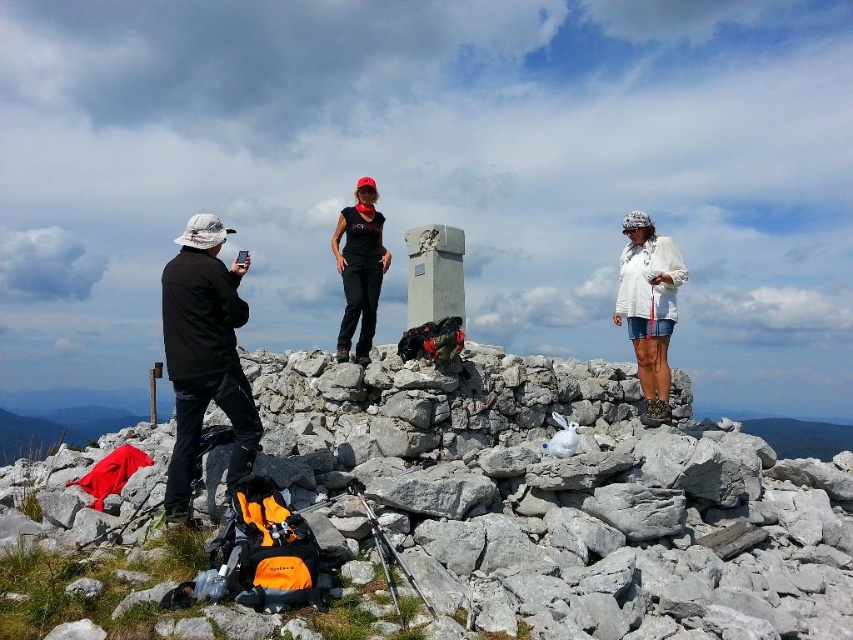
You are planning to take a photo of the black matte jacket at left from your current position. Based on the coordinates provided, is the jacket positioned to the left or right side of the image?

The black matte jacket at left is located at point 0.556 on the x and y axis, which places it on the left side of the image.

Based on the coordinates provided, which hiker is located at point (x=204, y=355)?

The black matte jacket at left is located at point (x=204, y=355).

You are a photographer trying to capture the scene. The white cotton shirt at upper right and the black matte shirt at center are both in your frame. Which shirt should you focus on if you want to highlight a smaller clothing item in your photo?

The white cotton shirt at upper right is smaller than the black matte shirt at center, so focusing on it would highlight the smaller clothing item.